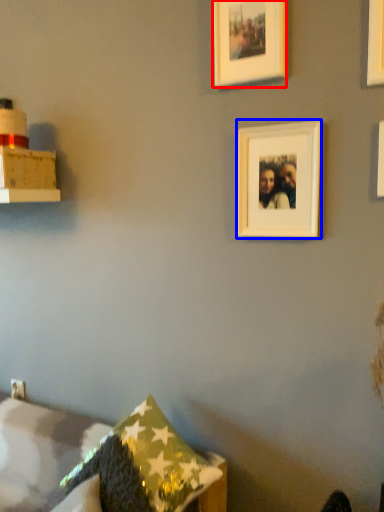
Question: Which point is closer to the camera, picture frame (highlighted by a red box) or picture frame (highlighted by a blue box)?

Choices:
 (A) picture frame
 (B) picture frame

Answer: (B)